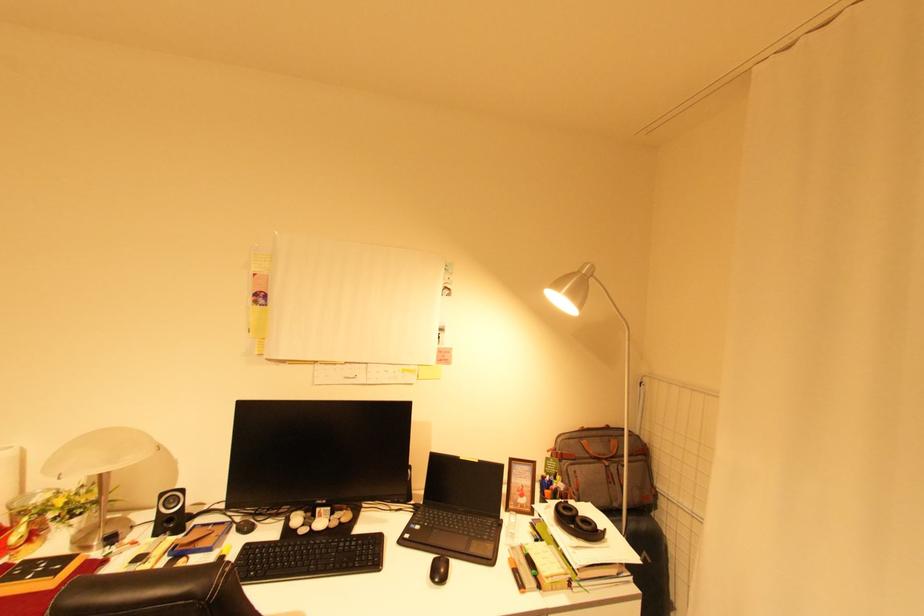
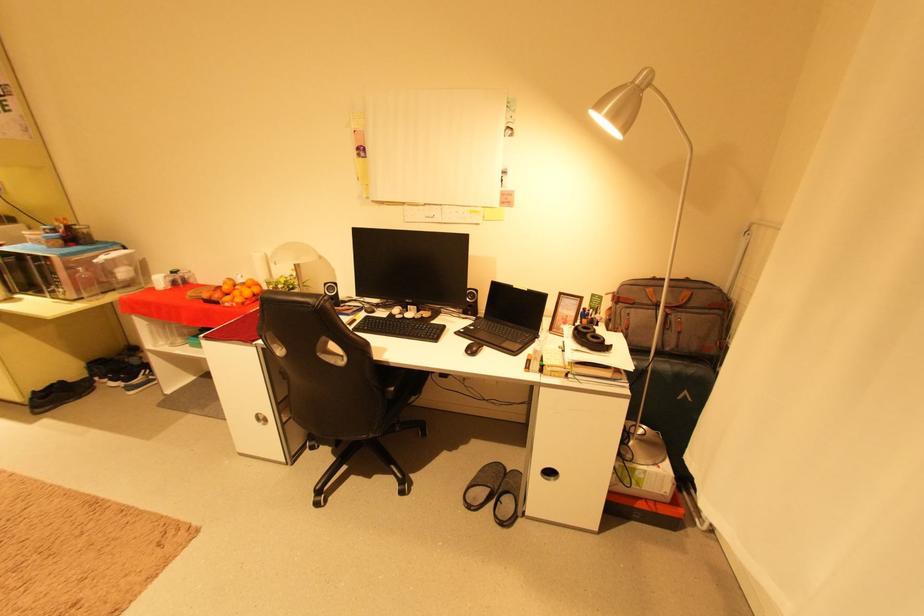
The point at (x=169, y=495) is marked in the first image. Where is the corresponding point in the second image?

(333, 285)